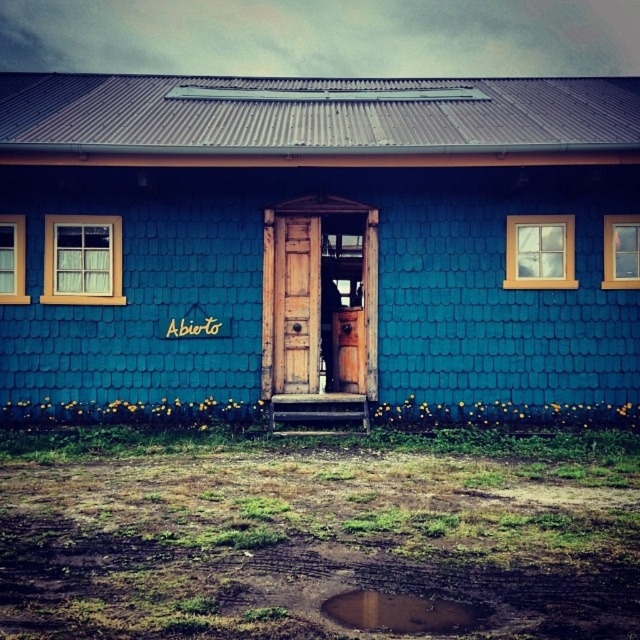
Where is `wooden door at center`? The height and width of the screenshot is (640, 640). wooden door at center is located at coordinates (324, 300).

The image size is (640, 640). I want to click on wooden door at center, so click(x=324, y=300).

Locate an element on the screen. This screenshot has height=640, width=640. wooden door at center is located at coordinates (324, 300).